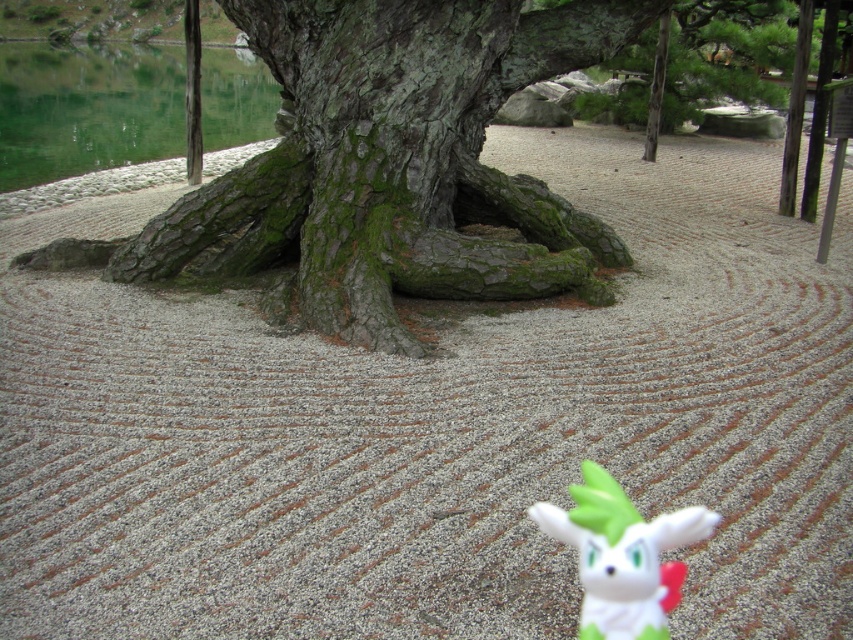
Looking at this image, is green mossy bark tree at center thinner than white matte plush toy at lower center?

In fact, green mossy bark tree at center might be wider than white matte plush toy at lower center.

Which is more to the left, green mossy bark tree at center or white matte plush toy at lower center?

green mossy bark tree at center is more to the left.

Locate an element on the screen. This screenshot has height=640, width=853. green mossy bark tree at center is located at coordinates (393, 163).